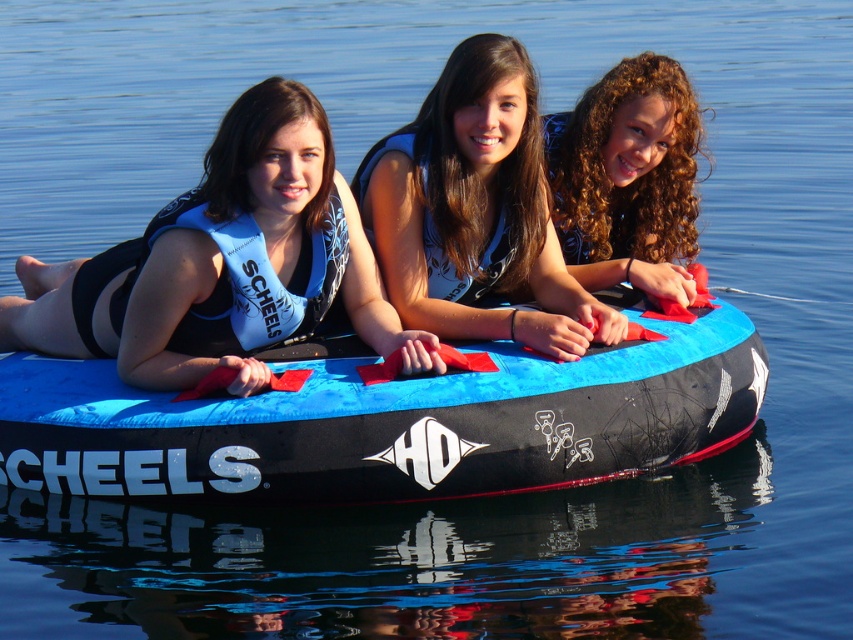
You are a lifeguard observing the scene. You need to identify which object is bigger between the matte blue life vest at left and the curly hair at center. Which one is larger?

The matte blue life vest at left is larger in size than the curly hair at center.

You are a lifeguard observing the scene. You notice two life vests on the inflatable tube. Which life vest is positioned lower on the tube, the matte blue life vest at left or the blue fabric life vest at center?

The matte blue life vest at left is positioned lower on the tube because it is below the blue fabric life vest at center.

You are a photographer trying to capture a clear photo of the curly hair at center without the matte blue life vest at left blocking it. How should you adjust your position?

Move your camera position to the right side so that the curly hair at center is no longer behind the matte blue life vest at left, which is currently in front of it.